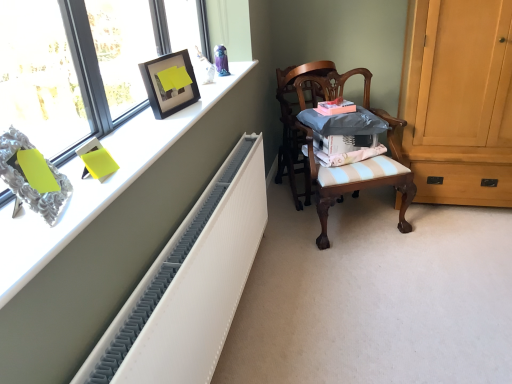
At what (x,y) coordinates should I click in order to perform the action: click on free space in front of matte black picture frame at upper left. Please return your answer as a coordinate pair (x, y). Looking at the image, I should click on (176, 122).